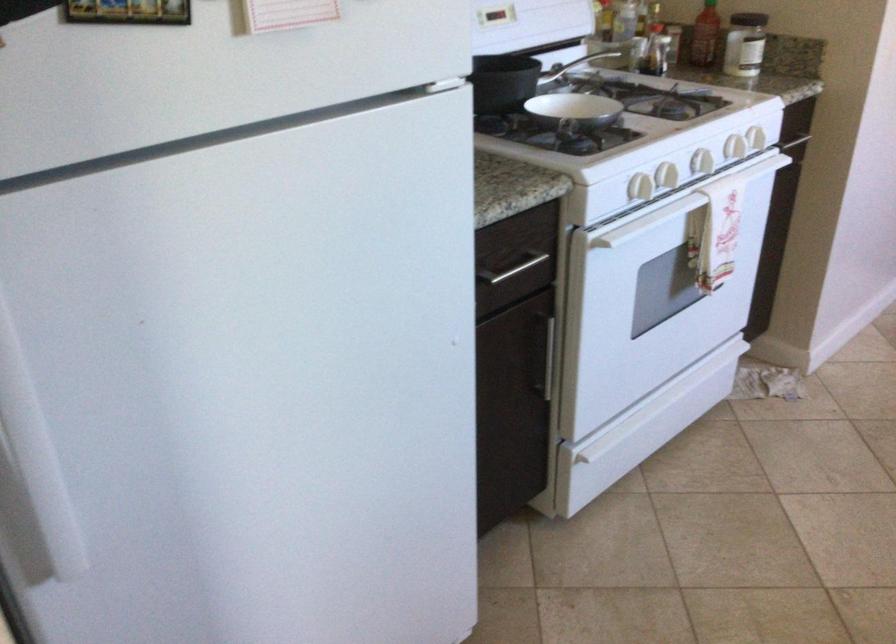
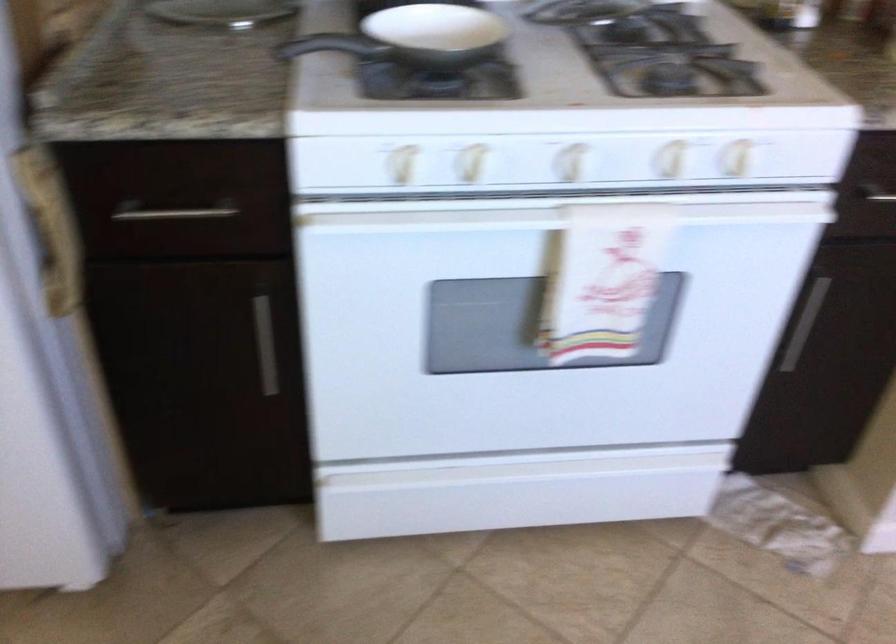
Question: I am providing you with two images of the same scene from different viewpoints. Please identify which objects are invisible in image2.

Choices:
 (A) silver cabinet handle
 (B) small white bowl
 (C) white stove knob
 (D) none of these

Answer: (D)